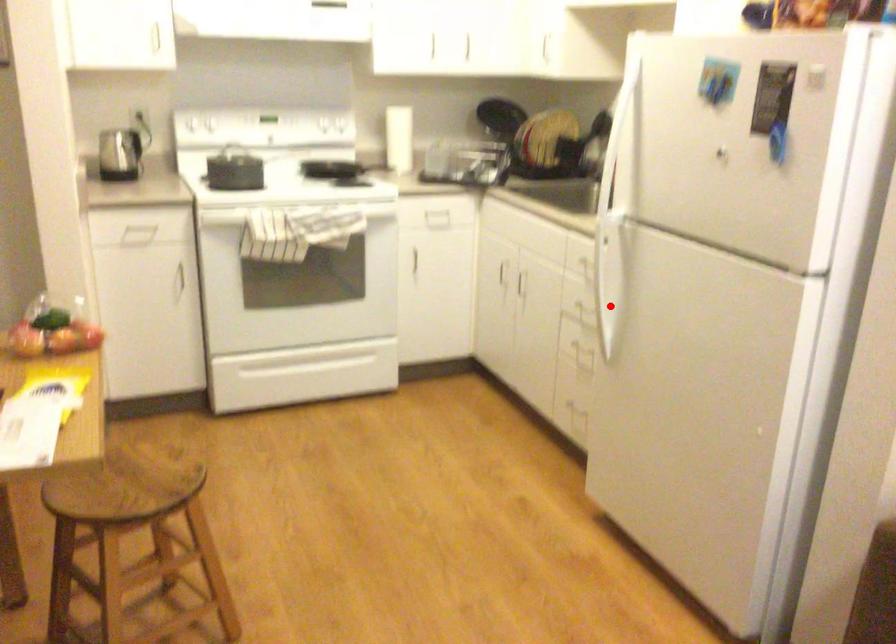
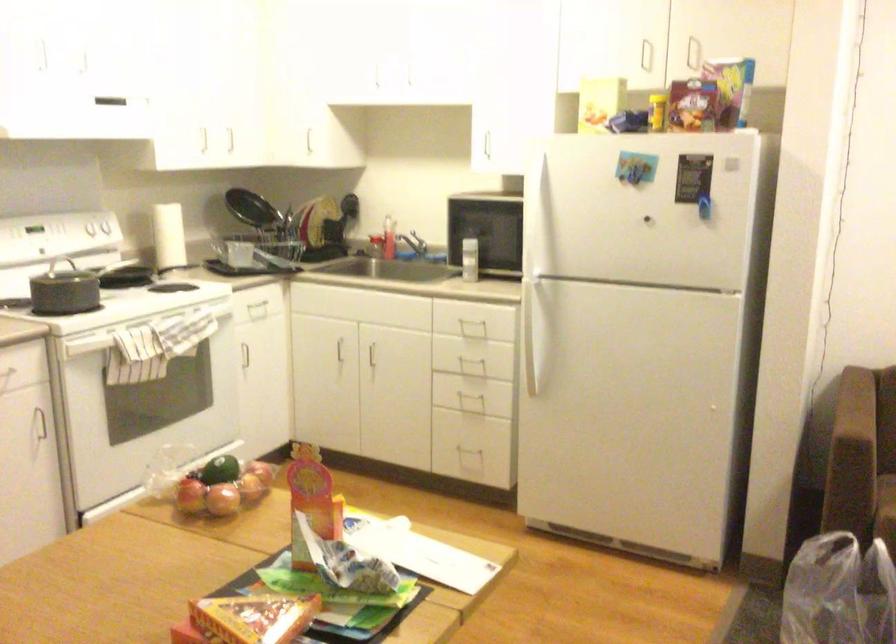
Question: I am providing you with two images of the same scene from different viewpoints. A red point is shown in image1. For the corresponding object point in image2, is it positioned nearer or farther from the camera?

Choices:
 (A) Nearer
 (B) Farther

Answer: (B)